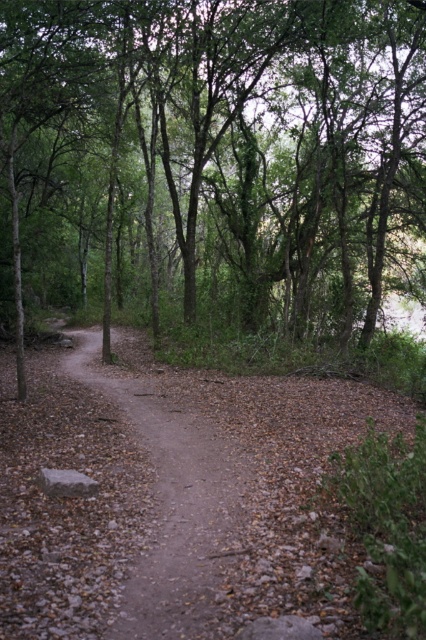
You are a hiker trying to follow the path in the forest. You see two paths at the center of the image. Which one is lower to the ground, the dusty brown dirt track at center or the dirt path at center?

The dusty brown dirt track at center is not as tall as dirt path at center, so the dusty brown dirt track at center is lower to the ground.

In the scene shown: You are a hiker trying to follow the dirt path at center in the forest. However, there is also a dusty brown dirt track at center. Which one should you follow to stay on the main trail?

The dusty brown dirt track at center is larger in size than the dirt path at center, so you should follow the dusty brown dirt track at center to stay on the main trail.